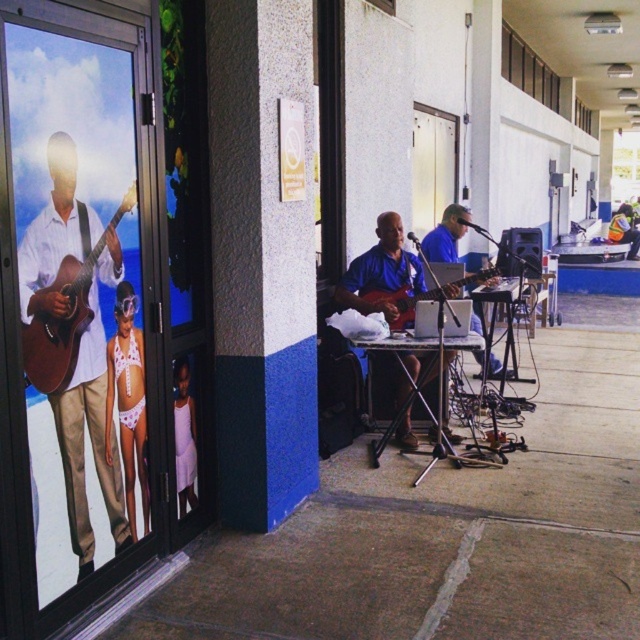
You are a passerby walking along the sidewalk and notice the white lace bikini at left and the orange reflective vest at center. Which object is located more to the left?

The white lace bikini at left is more to the left than the orange reflective vest at center.

You are a photographer standing at the entrance of the corridor. You want to take a photo of both the matte blue guitar at center and the brown acoustic guitar at left without any obstruction. Which guitar should you move and in which direction to ensure both are visible in the frame?

The brown acoustic guitar at left is behind the matte blue guitar at center. To ensure both are visible, you should move the brown acoustic guitar at left forward so it is no longer obstructed by the matte blue guitar at center.

You are standing at the point labeled point (x=93, y=218) and want to take a photo of the poster on the large glass door. The camera you are using has a maximum focus distance of 2.5 meters. Will you be able to focus on the poster clearly?

The distance between point (x=93, y=218) and the camera is 2.72 meters. Since the camera can only focus up to 2.5 meters, you will not be able to focus on the poster clearly.